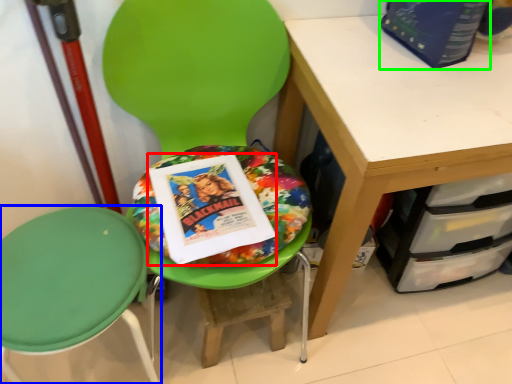
Question: Considering the real-world distances, which object is farthest from paperback book (highlighted by a red box)? chair (highlighted by a blue box) or paperback book (highlighted by a green box)?

Choices:
 (A) chair
 (B) paperback book

Answer: (B)